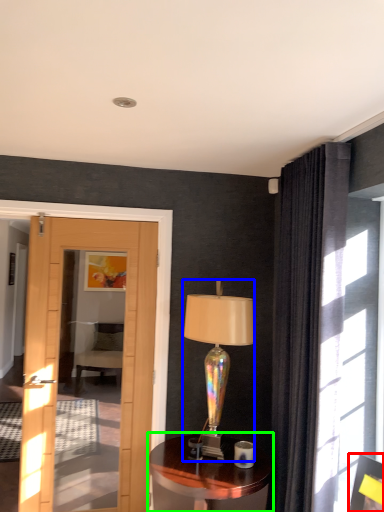
Question: Which object is the farthest from picture frame (highlighted by a red box)? Choose among these: lamp (highlighted by a blue box) or table (highlighted by a green box).

Choices:
 (A) lamp
 (B) table

Answer: (A)